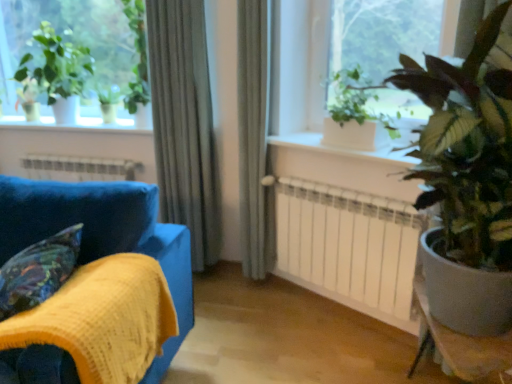
Question: Is green leafy plant at upper right to the right of green glossy plant at right, which ranks as the 1th houseplant in right-to-left order, from the viewer's perspective?

Choices:
 (A) yes
 (B) no

Answer: (B)

Question: Is green leafy plant at upper right oriented away from green glossy plant at right, the third houseplant viewed from the left?

Choices:
 (A) yes
 (B) no

Answer: (B)

Question: Is green leafy plant at upper right aimed at green glossy plant at right, the first houseplant positioned from the front?

Choices:
 (A) no
 (B) yes

Answer: (A)

Question: Does green leafy plant at upper right have a lesser width compared to green glossy plant at right, the first houseplant positioned from the front?

Choices:
 (A) no
 (B) yes

Answer: (B)

Question: Is green glossy plant at right, the first houseplant positioned from the front, completely or partially inside green leafy plant at upper right?

Choices:
 (A) no
 (B) yes

Answer: (A)

Question: Is point (102, 168) closer or farther from the camera than point (367, 147)?

Choices:
 (A) farther
 (B) closer

Answer: (A)

Question: From their relative heights in the image, would you say white metallic heater at lower center is taller or shorter than green matte plant at upper right, which is the second houseplant from back to front?

Choices:
 (A) short
 (B) tall

Answer: (A)

Question: Is white metallic heater at lower center in front of or behind green matte plant at upper right, placed as the second houseplant when sorted from front to back, in the image?

Choices:
 (A) behind
 (B) front

Answer: (A)

Question: Is white metallic heater at lower center situated inside green matte plant at upper right, placed as the second houseplant when sorted from left to right, or outside?

Choices:
 (A) outside
 (B) inside

Answer: (A)

Question: Considering the positions of velvet-like multicolored pillow at lower left and green leafy plant at upper right in the image, is velvet-like multicolored pillow at lower left bigger or smaller than green leafy plant at upper right?

Choices:
 (A) small
 (B) big

Answer: (B)

Question: Considering their positions, is velvet-like multicolored pillow at lower left located in front of or behind green leafy plant at upper right?

Choices:
 (A) behind
 (B) front

Answer: (B)

Question: From their relative heights in the image, would you say velvet-like multicolored pillow at lower left is taller or shorter than green leafy plant at upper right?

Choices:
 (A) tall
 (B) short

Answer: (B)

Question: Is point (31, 251) positioned closer to the camera than point (385, 8)?

Choices:
 (A) closer
 (B) farther

Answer: (A)

Question: From the image's perspective, is white matte radiator at center located above or below green glossy plant at right, the first houseplant positioned from the front?

Choices:
 (A) below
 (B) above

Answer: (A)

Question: Is white matte radiator at center bigger or smaller than green glossy plant at right, the first houseplant positioned from the front?

Choices:
 (A) small
 (B) big

Answer: (A)